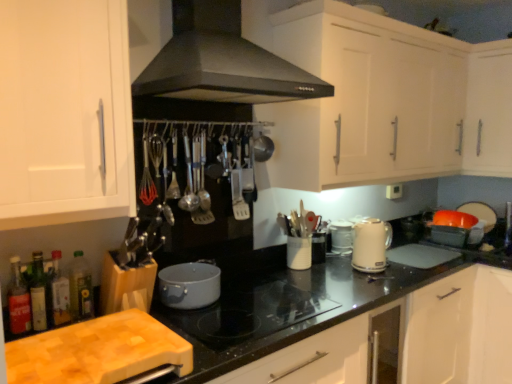
Question: Considering the positions of translucent glass bottle at lower left, the second bottle in the left-to-right sequence, and beige glossy electric kettle at right in the image, is translucent glass bottle at lower left, the second bottle in the left-to-right sequence, taller or shorter than beige glossy electric kettle at right?

Choices:
 (A) short
 (B) tall

Answer: (A)

Question: Considering the positions of translucent glass bottle at lower left, which is the third bottle from right to left, and beige glossy electric kettle at right in the image, is translucent glass bottle at lower left, which is the third bottle from right to left, wider or thinner than beige glossy electric kettle at right?

Choices:
 (A) wide
 (B) thin

Answer: (B)

Question: Based on their relative distances, which object is farther from the black matte range hood at upper center?

Choices:
 (A) white textured container at center, which is the 4th appliance from right to left
 (B) translucent glass bottle at lower left, the second bottle in the left-to-right sequence
 (C) matte gray pot at center, arranged as the 5th appliance when viewed from the right
 (D) white matte cabinet at left, the 2th cabinetry positioned from the bottom
 (E) beige glossy electric kettle at right

Answer: (E)

Question: Estimate the real-world distances between objects in this image. Which object is farther from the white glossy sink at upper right?

Choices:
 (A) matte gray pot at center, acting as the first appliance starting from the front
 (B) white matte cabinet at left, the 2th cabinetry positioned from the bottom
 (C) translucent glass bottle at lower left, arranged as the second bottle when viewed from the right
 (D) beige glossy electric kettle at right
 (E) translucent glass bottle at lower left, marked as the fourth bottle in a right-to-left arrangement

Answer: (E)